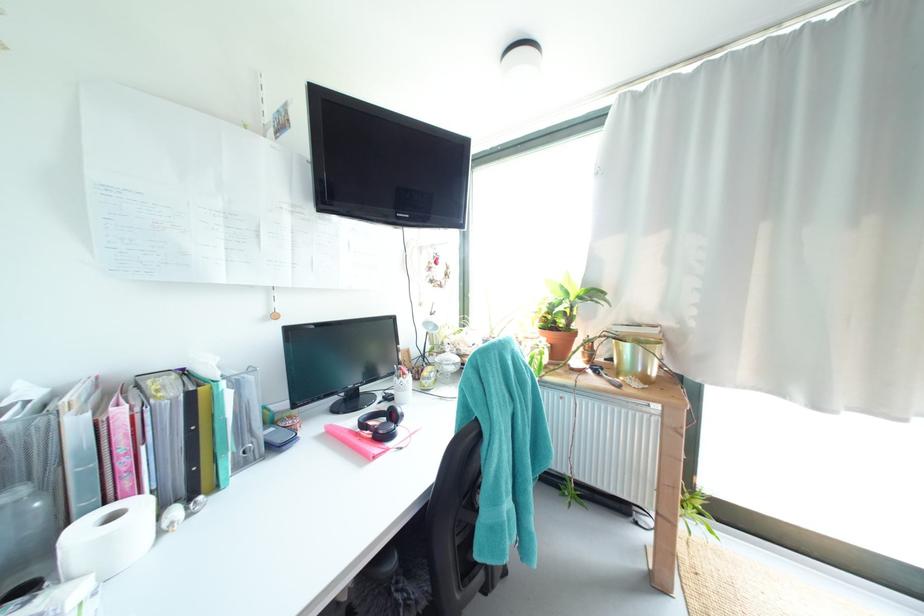
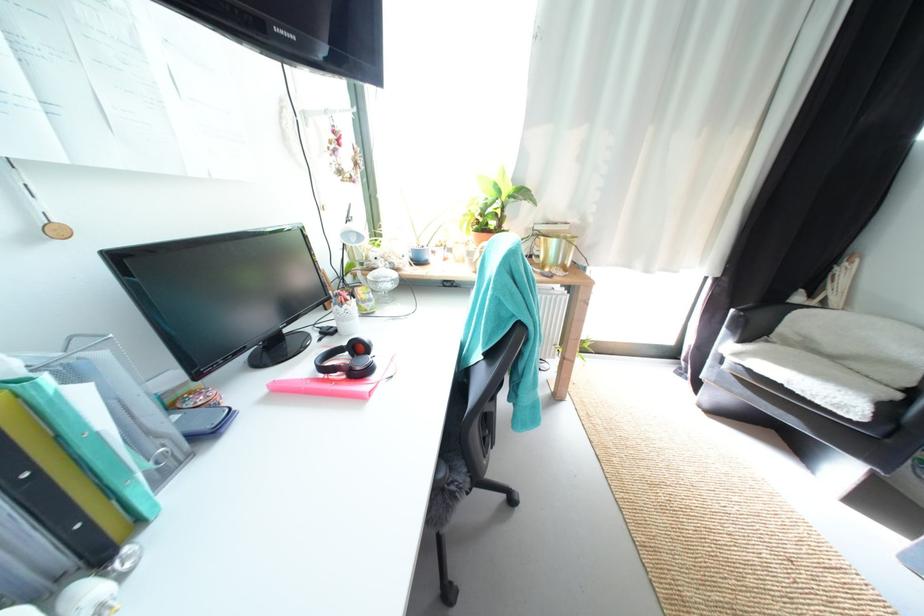
Locate, in the second image, the point that corresponds to pixel 334 429 in the first image.

(275, 387)